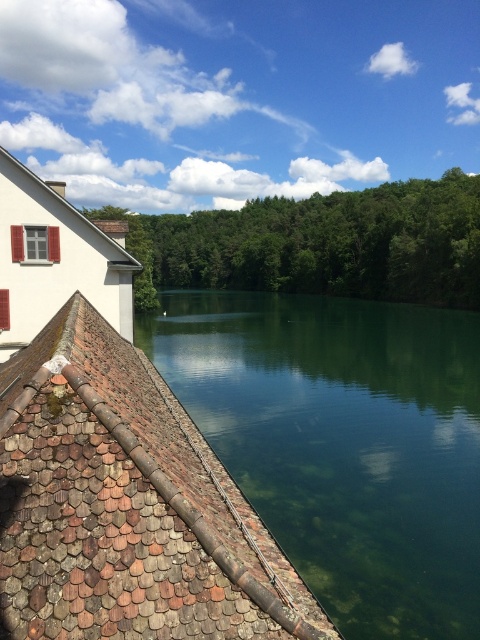
You are standing on the dock and looking at the scene. There is a point marked at coordinates (344, 442). Based on the description, where is this point located?

The point is located on the green glassy water at center.

You are standing on the dock and want to toss a stone into the water. Which object in the scene is wider, the green glassy water at center or the brown tile roof at lower left?

The green glassy water at center is wider than the brown tile roof at lower left.

You are a photographer planning to capture the entire scene in one shot. Given that the green glassy water at center and the brown tile roof at lower left are both in view, which object would occupy more of the frame?

The green glassy water at center occupies more of the frame since it has a larger size compared to the brown tile roof at lower left.